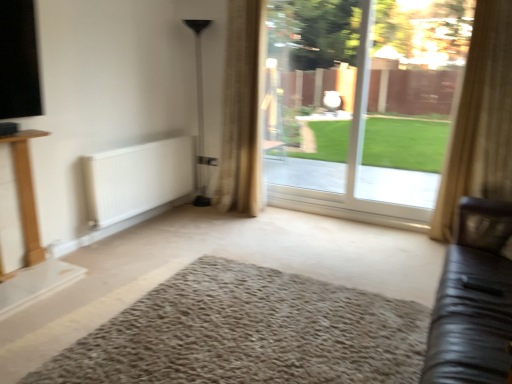
Question: Is black leather couch at right positioned with its back to beige textured curtain at center, the first curtain viewed from the left?

Choices:
 (A) no
 (B) yes

Answer: (A)

Question: Is black leather couch at right positioned behind beige textured curtain at center, placed as the 2th curtain when sorted from right to left?

Choices:
 (A) yes
 (B) no

Answer: (B)

Question: Is black leather couch at right touching beige textured curtain at center, arranged as the 1th curtain when viewed from the back?

Choices:
 (A) yes
 (B) no

Answer: (B)

Question: Is the depth of black leather couch at right less than that of beige textured curtain at center, placed as the 2th curtain when sorted from right to left?

Choices:
 (A) no
 (B) yes

Answer: (B)

Question: Does black leather couch at right have a greater height compared to beige textured curtain at center, arranged as the 1th curtain when viewed from the back?

Choices:
 (A) yes
 (B) no

Answer: (B)

Question: From the image's perspective, is transparent glass door at center positioned above or below beige textured curtain at right, which is the second curtain in back-to-front order?

Choices:
 (A) above
 (B) below

Answer: (A)

Question: Is transparent glass door at center bigger or smaller than beige textured curtain at right, acting as the first curtain starting from the right?

Choices:
 (A) big
 (B) small

Answer: (B)

Question: Considering the positions of point (373, 135) and point (481, 94), is point (373, 135) closer or farther from the camera than point (481, 94)?

Choices:
 (A) closer
 (B) farther

Answer: (B)

Question: Would you say transparent glass door at center is inside or outside beige textured curtain at right, placed as the 1th curtain when sorted from front to back?

Choices:
 (A) inside
 (B) outside

Answer: (B)

Question: Considering the positions of white matte radiator at lower left and black leather couch at right in the image, is white matte radiator at lower left wider or thinner than black leather couch at right?

Choices:
 (A) wide
 (B) thin

Answer: (B)

Question: Is white matte radiator at lower left in front of or behind black leather couch at right in the image?

Choices:
 (A) behind
 (B) front

Answer: (A)

Question: Choose the correct answer: Is white matte radiator at lower left inside black leather couch at right or outside it?

Choices:
 (A) outside
 (B) inside

Answer: (A)

Question: In terms of size, does white matte radiator at lower left appear bigger or smaller than black leather couch at right?

Choices:
 (A) small
 (B) big

Answer: (A)

Question: Considering the positions of transparent glass door at center and beige textured curtain at center, arranged as the 1th curtain when viewed from the back, in the image, is transparent glass door at center bigger or smaller than beige textured curtain at center, arranged as the 1th curtain when viewed from the back,?

Choices:
 (A) small
 (B) big

Answer: (A)

Question: Is transparent glass door at center taller or shorter than beige textured curtain at center, the first curtain viewed from the left?

Choices:
 (A) tall
 (B) short

Answer: (B)